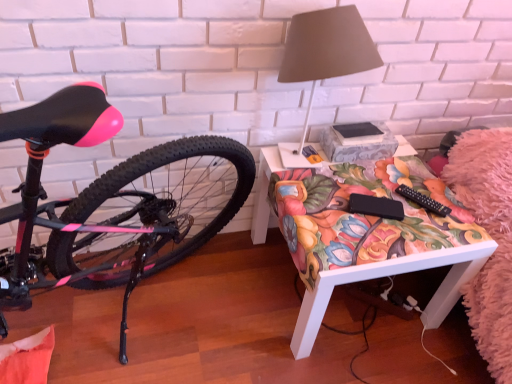
You are a GUI agent. You are given a task and a screenshot of the screen. Output one action in this format:
    pyautogui.click(x=<x>, y=<y>)
    Task: Click on the vacant area situated to the left side of floral fabric desk at center
    The height and width of the screenshot is (384, 512).
    Given the screenshot: What is the action you would take?
    pyautogui.click(x=211, y=301)